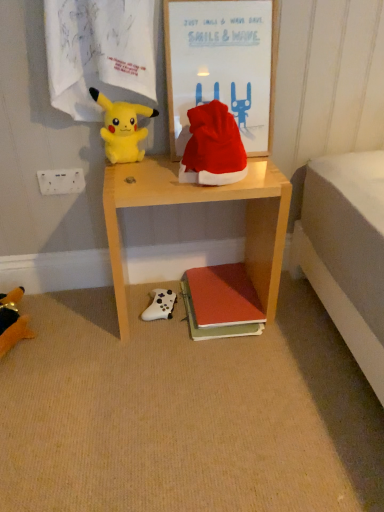
The height and width of the screenshot is (512, 384). I want to click on unoccupied space behind white matte game controller at lower center, the first toy positioned from the right, so [x=157, y=282].